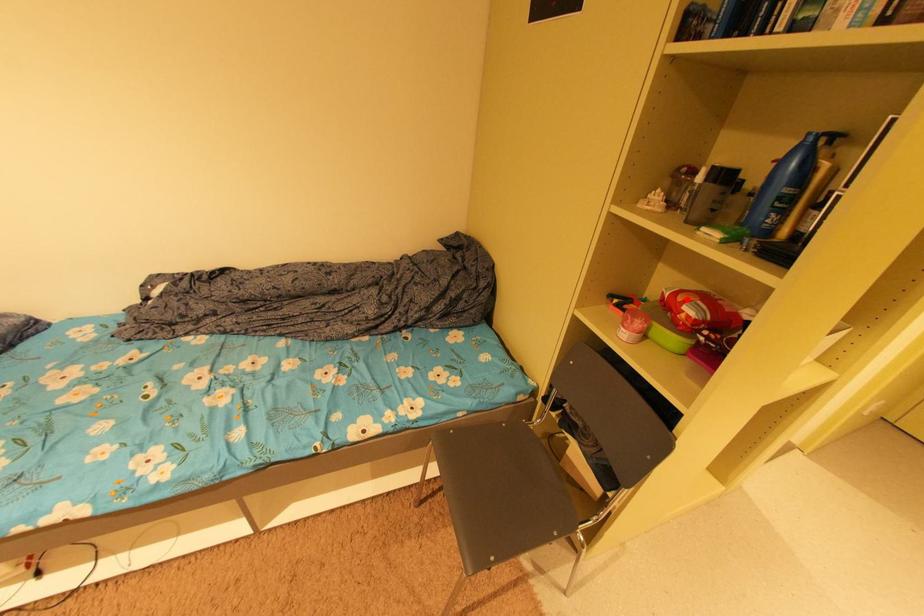
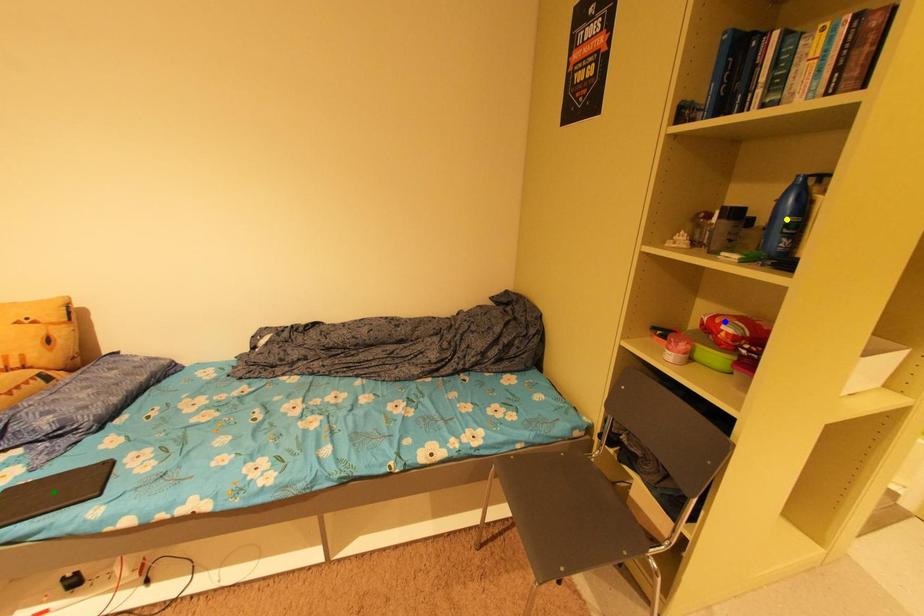
Question: I am providing you with two images of the same scene from different viewpoints. A red point is marked on the first image. You are given multiple points on the second image. Which point in image 2 is actually the same real-world point as the red point in image 1?

Choices:
 (A) green point
 (B) blue point
 (C) yellow point

Answer: (B)